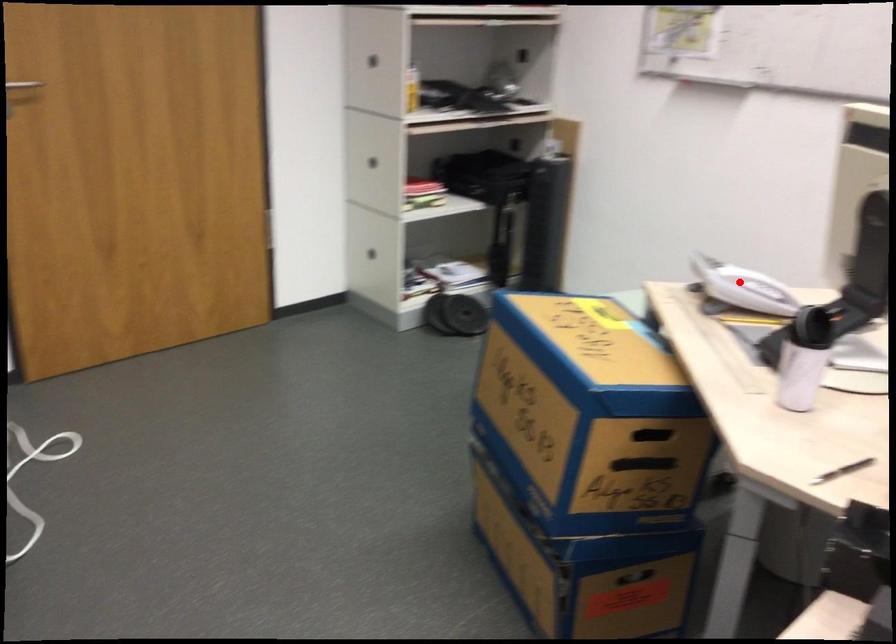
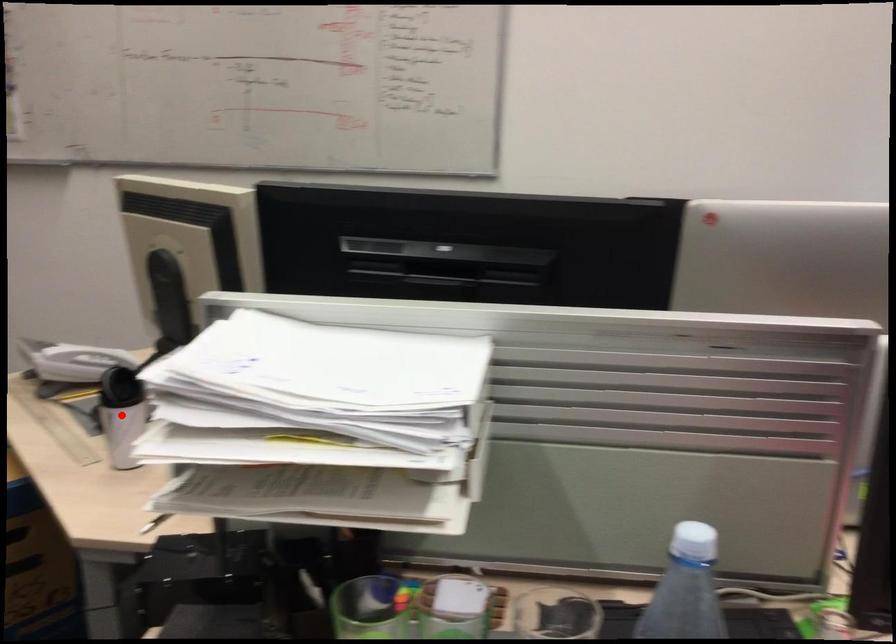
I am providing you with two images of the same scene from different viewpoints. A red point is marked on the first image and another point is marked on the second image. Are the points marked in image1 and image2 representing the same 3D position?

No